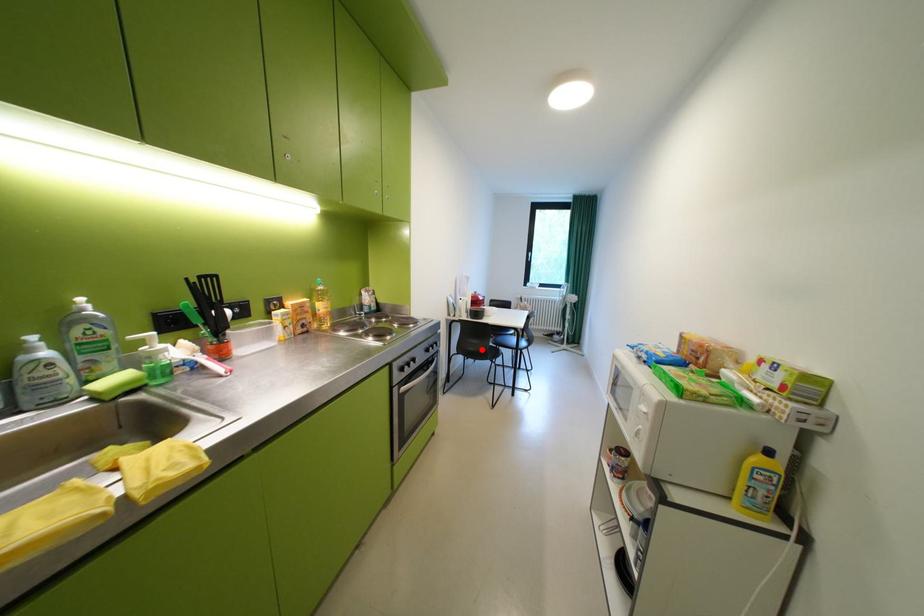
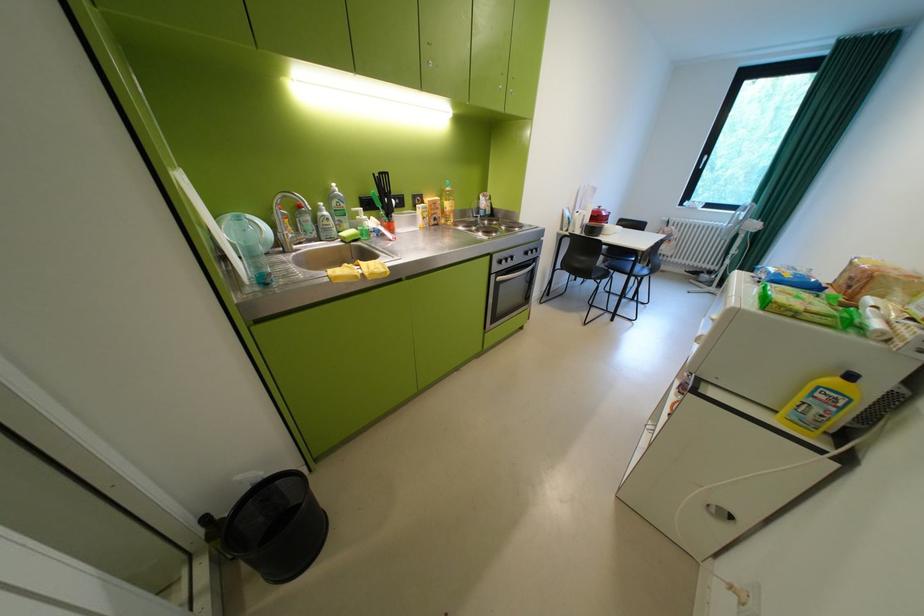
Question: A red point is marked in image1. In image2, is the corresponding 3D point closer to the camera or farther? Reply with the corresponding letter.

Choices:
 (A) The corresponding 3D point is closer.
 (B) The corresponding 3D point is farther.

Answer: (A)